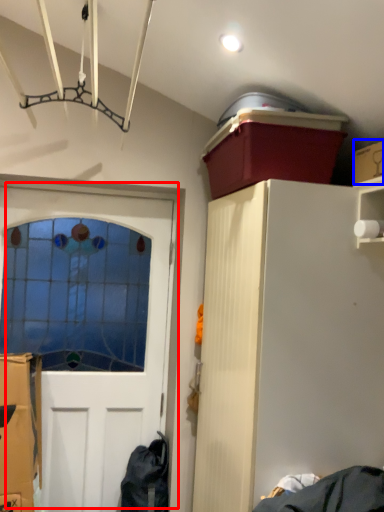
Question: Among these objects, which one is farthest to the camera, door (highlighted by a red box) or cardboard box (highlighted by a blue box)?

Choices:
 (A) door
 (B) cardboard box

Answer: (A)